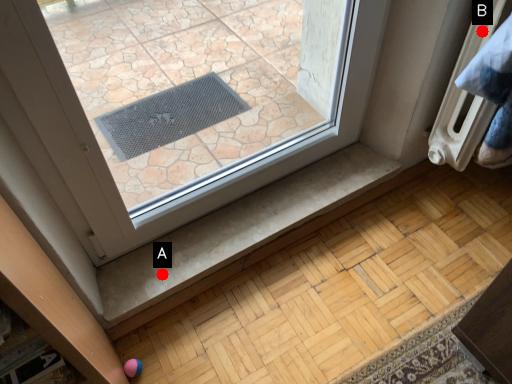
Question: Two points are circled on the image, labeled by A and B beside each circle. Which point appears closest to the camera in this image?

Choices:
 (A) A is closer
 (B) B is closer

Answer: (B)